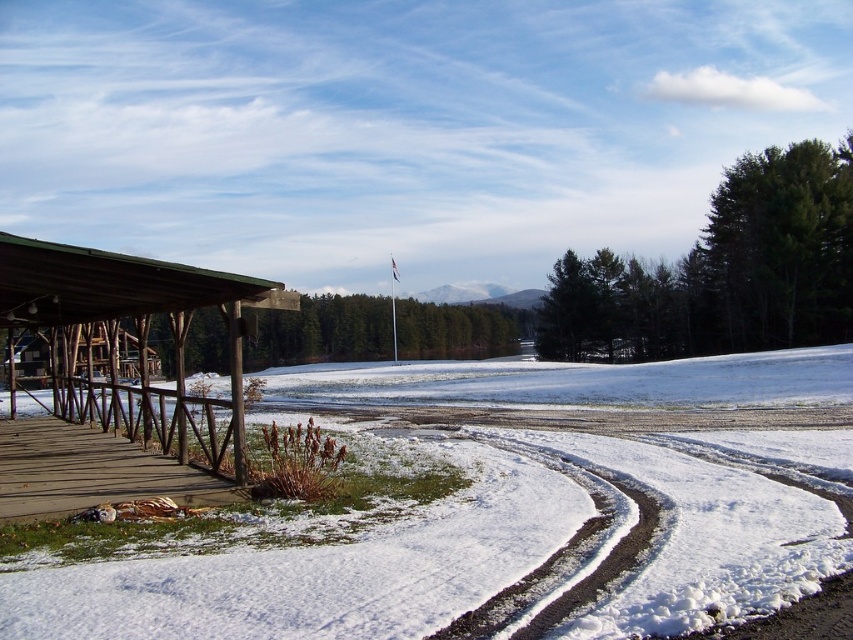
You are standing at the point marked by point (132, 308), which is the brown wooden hut at left. You want to walk to the wooden structure with a green roof in the foreground. Which direction should you head?

The wooden structure with a green roof is in the foreground, so you should head towards it by moving away from the brown wooden hut at left towards the center of the image.

You are a hiker trying to cross the area near the wooden structure. You see the white powdery snow at lower left and the wooden planks at lower left. Which surface is deeper?

The white powdery snow at lower left has a greater height compared to wooden planks at lower left, so the snow is deeper than the wooden planks.

In the scene shown: You are standing at the wooden structure with a green roof in the foreground of the winter scene. You want to walk towards the white powdery snow at lower left represented by point (477, 545). Is the path leading towards that point clear of snow?

The white powdery snow at lower left is represented by point (477, 545). The path leading towards that point is partially cleared of snow, so parts of it may have snow remaining. You should check the path carefully before walking.